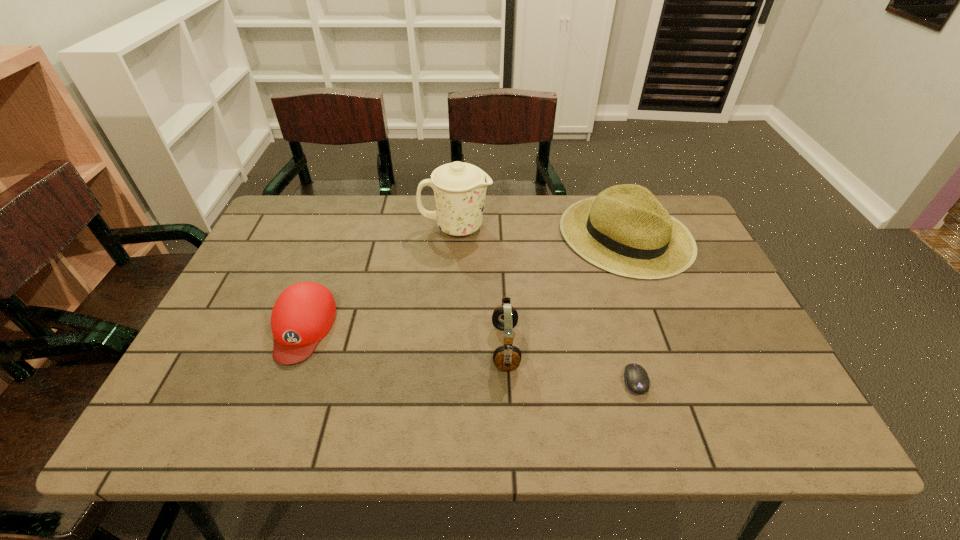
In the image, there is a desktop. At what (x,y) coordinates should I click in order to perform the action: click on free space at the right edge. Please return your answer as a coordinate pair (x, y). This screenshot has height=540, width=960. Looking at the image, I should click on (699, 302).

This screenshot has width=960, height=540. In order to click on free space at the far left corner of the desktop in this screenshot , I will do `click(288, 241)`.

You are a GUI agent. You are given a task and a screenshot of the screen. Output one action in this format:
    pyautogui.click(x=<x>, y=<y>)
    Task: Click on the free spot at the far right corner of the desktop
    This screenshot has height=540, width=960.
    Given the screenshot: What is the action you would take?
    pyautogui.click(x=675, y=213)

The width and height of the screenshot is (960, 540). I want to click on free region at the near right corner of the desktop, so click(727, 407).

Where is `vacant space that's between the baseball cap and the computer mouse`? This screenshot has height=540, width=960. vacant space that's between the baseball cap and the computer mouse is located at coordinates (469, 354).

Where is `free space between the chinaware and the sunhat`? The height and width of the screenshot is (540, 960). free space between the chinaware and the sunhat is located at coordinates (540, 231).

I want to click on empty location between the chinaware and the shortest object, so click(x=545, y=304).

This screenshot has width=960, height=540. Identify the location of free space between the headset and the sunhat. (565, 291).

Locate an element on the screen. free space between the second shortest object and the headset is located at coordinates (404, 338).

The width and height of the screenshot is (960, 540). What are the coordinates of `unoccupied position between the sunhat and the tallest object` in the screenshot? It's located at (540, 231).